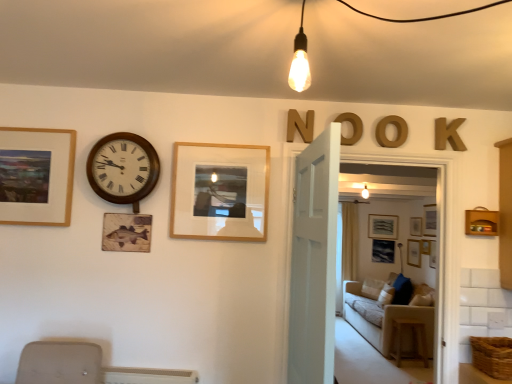
Question: From a real-world perspective, is wooden at right on top of wooden frame at center, placed as the second picture frame when sorted from top to bottom?

Choices:
 (A) no
 (B) yes

Answer: (A)

Question: Can you confirm if wooden at right is bigger than wooden frame at center, which is the second picture frame in left-to-right order?

Choices:
 (A) yes
 (B) no

Answer: (A)

Question: Is wooden at right smaller than wooden frame at center, placed as the second picture frame when sorted from top to bottom?

Choices:
 (A) no
 (B) yes

Answer: (A)

Question: Can you confirm if wooden at right is thinner than wooden frame at center, placed as the second picture frame when sorted from top to bottom?

Choices:
 (A) yes
 (B) no

Answer: (B)

Question: Does wooden at right have a lesser height compared to wooden frame at center, placed as the second picture frame when sorted from top to bottom?

Choices:
 (A) yes
 (B) no

Answer: (A)

Question: Does point (441, 170) appear closer or farther from the camera than point (373, 236)?

Choices:
 (A) closer
 (B) farther

Answer: (A)

Question: Relative to matte gray picture frame at center, which is counted as the 4th picture frame, starting from the left, is transparent glass door at center in front or behind?

Choices:
 (A) front
 (B) behind

Answer: (A)

Question: Would you say transparent glass door at center is to the left or to the right of matte gray picture frame at center, the third picture frame when ordered from top to bottom, in the picture?

Choices:
 (A) right
 (B) left

Answer: (B)

Question: In terms of size, does transparent glass door at center appear bigger or smaller than matte gray picture frame at center, which is counted as the 4th picture frame, starting from the left?

Choices:
 (A) small
 (B) big

Answer: (B)

Question: In terms of width, does beige fabric couch at center look wider or thinner when compared to wooden frame at center, which is the 2th picture frame from front to back?

Choices:
 (A) wide
 (B) thin

Answer: (A)

Question: Considering their positions, is beige fabric couch at center located in front of or behind wooden frame at center, which is the 3th picture frame from bottom to top?

Choices:
 (A) front
 (B) behind

Answer: (B)

Question: Is beige fabric couch at center to the left or to the right of wooden frame at center, which ranks as the third picture frame in back-to-front order, in the image?

Choices:
 (A) right
 (B) left

Answer: (A)

Question: Is point (377, 299) closer or farther from the camera than point (258, 162)?

Choices:
 (A) farther
 (B) closer

Answer: (A)

Question: From their relative heights in the image, would you say wooden frame at center, which is the 3th picture frame from bottom to top, is taller or shorter than wooden at right?

Choices:
 (A) tall
 (B) short

Answer: (A)

Question: In terms of width, does wooden frame at center, which is the 2th picture frame from front to back, look wider or thinner when compared to wooden at right?

Choices:
 (A) wide
 (B) thin

Answer: (B)